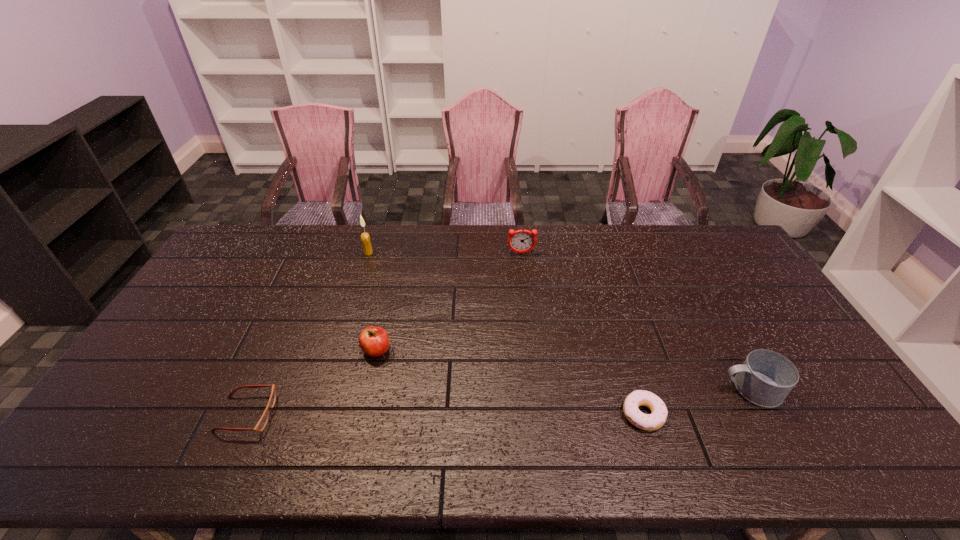
I want to click on the fifth object from right to left, so click(365, 238).

Image resolution: width=960 pixels, height=540 pixels. What are the coordinates of `candle` in the screenshot? It's located at (365, 238).

What are the coordinates of `the fourth object from left to right` in the screenshot? It's located at (521, 241).

Locate an element on the screen. This screenshot has width=960, height=540. the rightmost object is located at coordinates (766, 377).

You are a GUI agent. You are given a task and a screenshot of the screen. Output one action in this format:
    pyautogui.click(x=<x>, y=<y>)
    Task: Click on the fourth object from right to left
    The width and height of the screenshot is (960, 540).
    Given the screenshot: What is the action you would take?
    pyautogui.click(x=374, y=341)

Where is `apple`? The image size is (960, 540). apple is located at coordinates (374, 341).

Locate an element on the screen. This screenshot has height=540, width=960. the leftmost object is located at coordinates (261, 424).

You are a GUI agent. You are given a task and a screenshot of the screen. Output one action in this format:
    pyautogui.click(x=<x>, y=<y>)
    Task: Click on the doughnut
    The width and height of the screenshot is (960, 540).
    Given the screenshot: What is the action you would take?
    pyautogui.click(x=649, y=422)

The image size is (960, 540). I want to click on free space located 0.140m on the back of the tallest object, so pyautogui.click(x=376, y=228).

Locate an element on the screen. The image size is (960, 540). free space located on the front-facing side of the alarm clock is located at coordinates (525, 285).